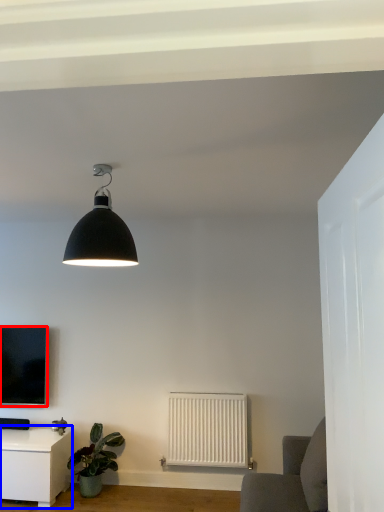
Question: Which object appears farthest to the camera in this image, television (highlighted by a red box) or table (highlighted by a blue box)?

Choices:
 (A) television
 (B) table

Answer: (A)